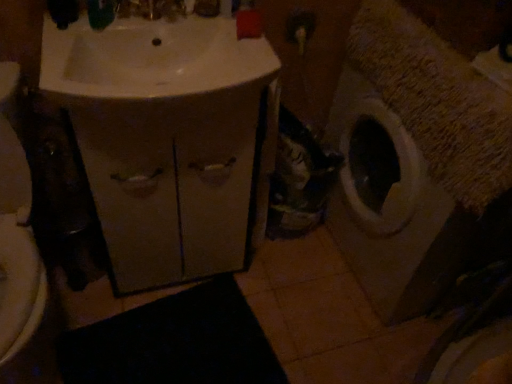
Question: From the image's perspective, is textured beige washing machine at right above black rubber bath mat at lower center?

Choices:
 (A) no
 (B) yes

Answer: (B)

Question: Is textured beige washing machine at right next to black rubber bath mat at lower center and touching it?

Choices:
 (A) no
 (B) yes

Answer: (A)

Question: Can you confirm if textured beige washing machine at right is smaller than black rubber bath mat at lower center?

Choices:
 (A) no
 (B) yes

Answer: (A)

Question: Can black rubber bath mat at lower center be found inside textured beige washing machine at right?

Choices:
 (A) no
 (B) yes

Answer: (A)

Question: Does textured beige washing machine at right appear on the left side of black rubber bath mat at lower center?

Choices:
 (A) yes
 (B) no

Answer: (B)

Question: Looking at their shapes, would you say textured beige washing machine at right is wider or thinner than black rubber bath mat at lower center?

Choices:
 (A) wide
 (B) thin

Answer: (A)

Question: From a real-world perspective, is textured beige washing machine at right above or below black rubber bath mat at lower center?

Choices:
 (A) above
 (B) below

Answer: (A)

Question: Considering their positions, is textured beige washing machine at right located in front of or behind black rubber bath mat at lower center?

Choices:
 (A) behind
 (B) front

Answer: (B)

Question: From the image's perspective, is textured beige washing machine at right located above or below black rubber bath mat at lower center?

Choices:
 (A) below
 (B) above

Answer: (B)

Question: Based on their positions, is black rubber bath mat at lower center located to the left or right of textured beige washing machine at right?

Choices:
 (A) left
 (B) right

Answer: (A)

Question: From a real-world perspective, is black rubber bath mat at lower center physically located above or below textured beige washing machine at right?

Choices:
 (A) below
 (B) above

Answer: (A)

Question: Is black rubber bath mat at lower center taller or shorter than textured beige washing machine at right?

Choices:
 (A) short
 (B) tall

Answer: (A)

Question: Is black rubber bath mat at lower center inside the boundaries of textured beige washing machine at right, or outside?

Choices:
 (A) outside
 (B) inside

Answer: (A)

Question: From a real-world perspective, is black rubber bath mat at lower center physically located above or below matte beige cabinet at center?

Choices:
 (A) above
 (B) below

Answer: (B)

Question: Is black rubber bath mat at lower center in front of or behind matte beige cabinet at center in the image?

Choices:
 (A) front
 (B) behind

Answer: (B)